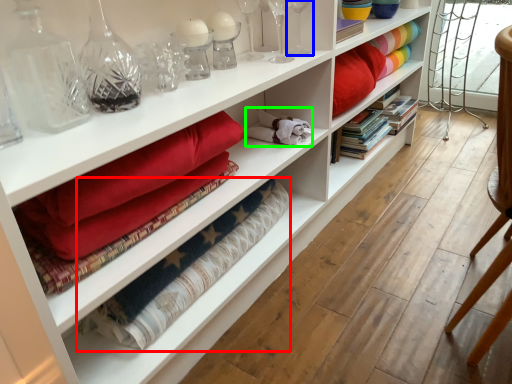
Question: Considering the real-world distances, which object is farthest from material (highlighted by a red box)? glass vase (highlighted by a blue box) or clothing (highlighted by a green box)?

Choices:
 (A) glass vase
 (B) clothing

Answer: (A)